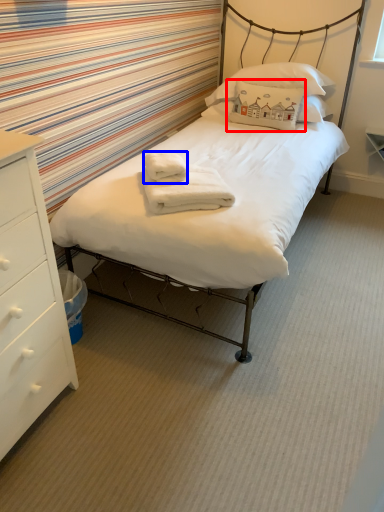
Question: Which object is further to the camera taking this photo, pillow (highlighted by a red box) or bath towel (highlighted by a blue box)?

Choices:
 (A) pillow
 (B) bath towel

Answer: (A)